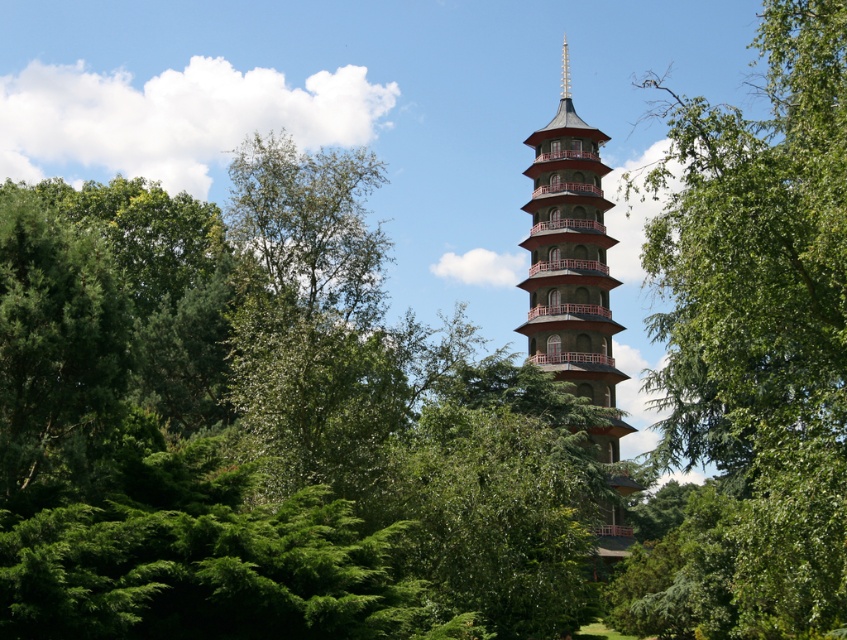
Can you confirm if green textured pagoda at center is shorter than gold metallic spire at center?

Incorrect, green textured pagoda at center's height does not fall short of gold metallic spire at center's.

In the scene shown: Between green textured pagoda at center and gold metallic spire at center, which one appears on the right side from the viewer's perspective?

From the viewer's perspective, gold metallic spire at center appears more on the right side.

Does point (584, 140) come in front of point (565, 52)?

That is True.

Locate an element on the screen. green textured pagoda at center is located at coordinates (569, 259).

Is green leafy tree at center bigger than gold metallic spire at center?

Correct, green leafy tree at center is larger in size than gold metallic spire at center.

Can you confirm if green leafy tree at center is shorter than gold metallic spire at center?

No, green leafy tree at center is not shorter than gold metallic spire at center.

The height and width of the screenshot is (640, 847). What do you see at coordinates (756, 346) in the screenshot?
I see `green leafy tree at center` at bounding box center [756, 346].

Find the location of a particular element. This screenshot has height=640, width=847. green leafy tree at center is located at coordinates (756, 346).

Based on the photo, is green leafy tree at center bigger than green textured pagoda at center?

Yes, green leafy tree at center is bigger than green textured pagoda at center.

Between point (689, 616) and point (590, 308), which one is positioned in front?

Positioned in front is point (689, 616).

Locate an element on the screen. This screenshot has width=847, height=640. green leafy tree at center is located at coordinates click(756, 346).